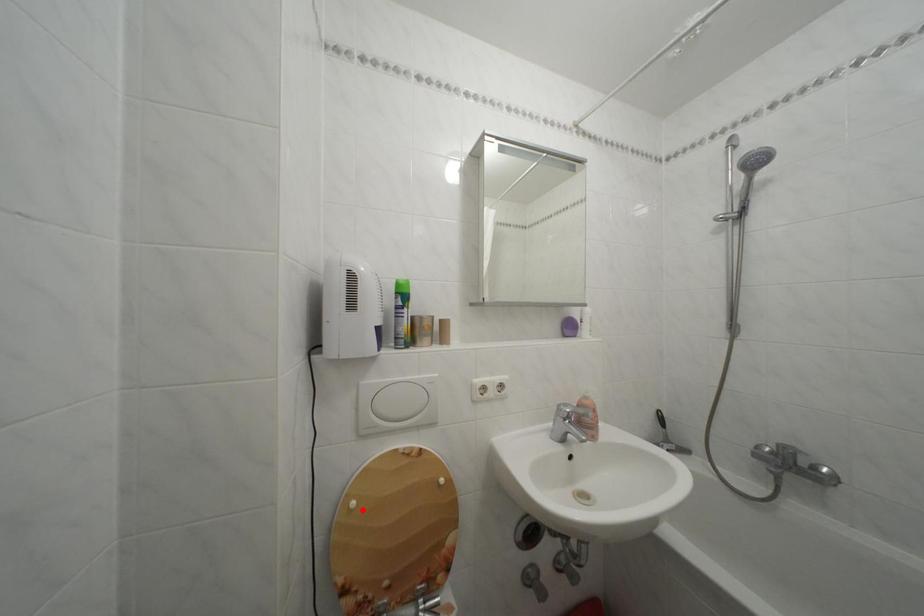
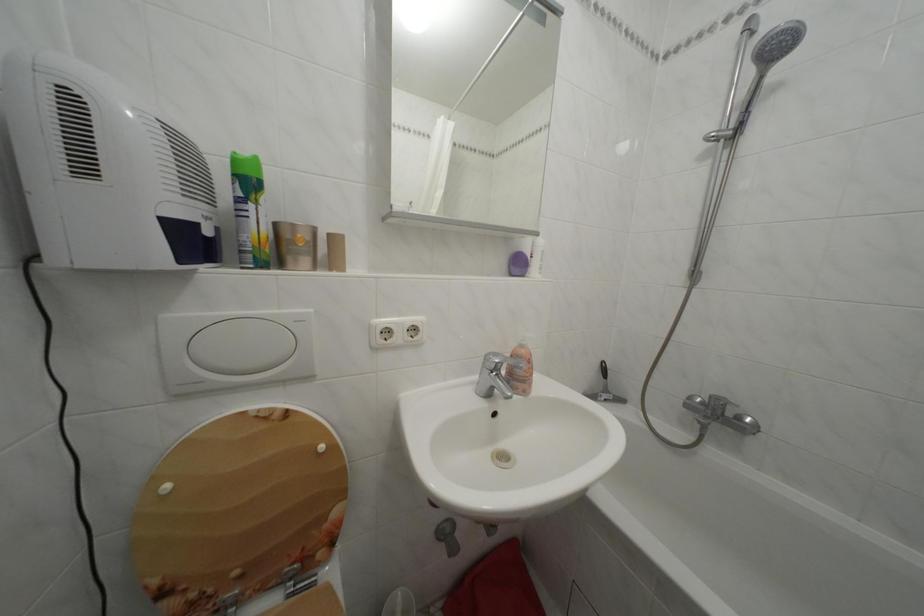
Question: I am providing you with two images of the same scene from different viewpoints. A red point is shown in image1. For the corresponding object point in image2, is it positioned nearer or farther from the camera?

Choices:
 (A) Nearer
 (B) Farther

Answer: (A)